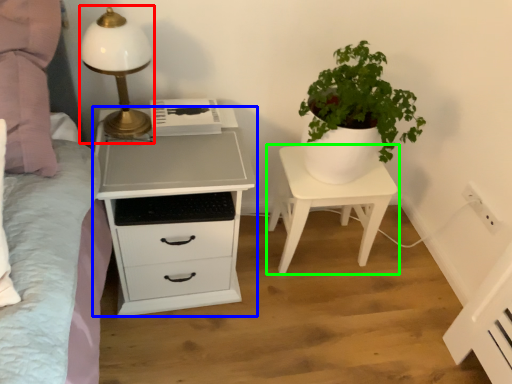
Question: Estimate the real-world distances between objects in this image. Which object is closer to table lamp (highlighted by a red box), chest of drawers (highlighted by a blue box) or nightstand (highlighted by a green box)?

Choices:
 (A) chest of drawers
 (B) nightstand

Answer: (A)